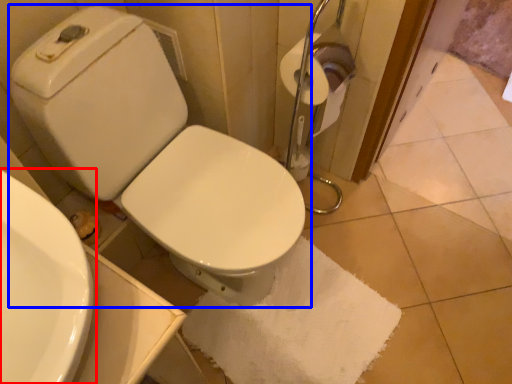
Question: Among these objects, which one is nearest to the camera, sink (highlighted by a red box) or toilet (highlighted by a blue box)?

Choices:
 (A) sink
 (B) toilet

Answer: (A)